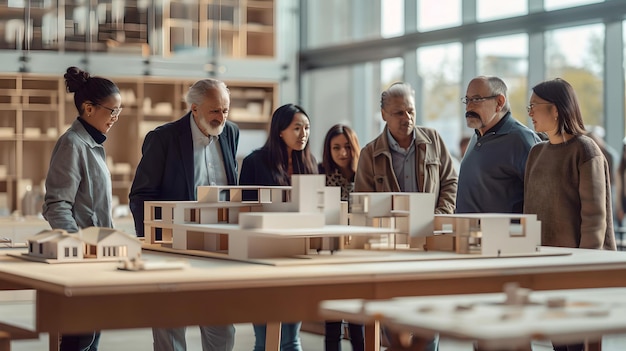
Image resolution: width=626 pixels, height=351 pixels. I want to click on small table, so click(x=429, y=321).